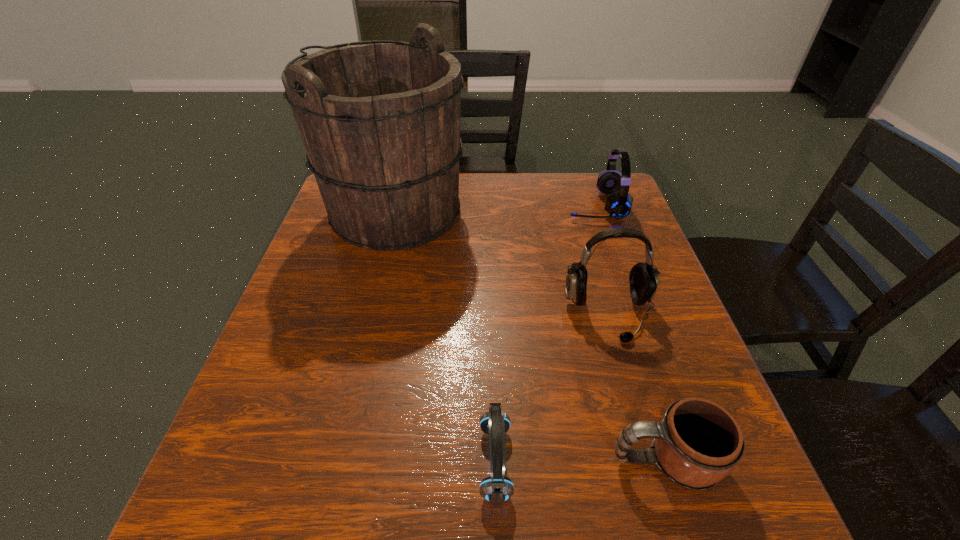
You are a GUI agent. You are given a task and a screenshot of the screen. Output one action in this format:
    pyautogui.click(x=<x>, y=<y>)
    Task: Click on the vacant space located with the microphone on the side of the tallest headset
    Image resolution: width=960 pixels, height=540 pixels.
    Given the screenshot: What is the action you would take?
    pyautogui.click(x=651, y=464)

Find the location of `vacant space located on the ear cushions of the farthest headset`. vacant space located on the ear cushions of the farthest headset is located at coordinates (494, 206).

This screenshot has height=540, width=960. Find the location of `free space located on the ear cushions of the farthest headset`. free space located on the ear cushions of the farthest headset is located at coordinates (534, 206).

The image size is (960, 540). In order to click on vacant area situated 0.190m on the ear cushions of the farthest headset in this screenshot , I will do `click(498, 206)`.

This screenshot has height=540, width=960. Identify the location of free space located 0.260m on the side of the mug with the handle. (448, 460).

I want to click on vacant region located on the side of the mug with the handle, so click(443, 460).

The height and width of the screenshot is (540, 960). Identify the location of vacant space located on the side of the mug with the handle. (398, 460).

Locate an element on the screen. vacant position located on the ear cups of the shortest headset is located at coordinates (368, 462).

Locate an element on the screen. The height and width of the screenshot is (540, 960). vacant space positioned 0.290m on the ear cups of the shortest headset is located at coordinates (300, 462).

The width and height of the screenshot is (960, 540). In order to click on free space located 0.210m on the ear cups of the shortest headset in this screenshot , I will do `click(348, 462)`.